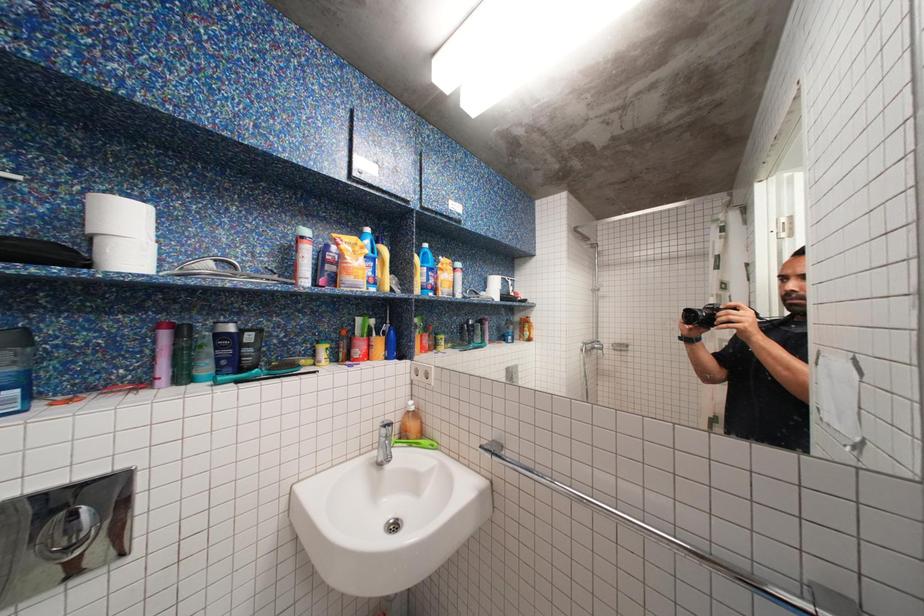
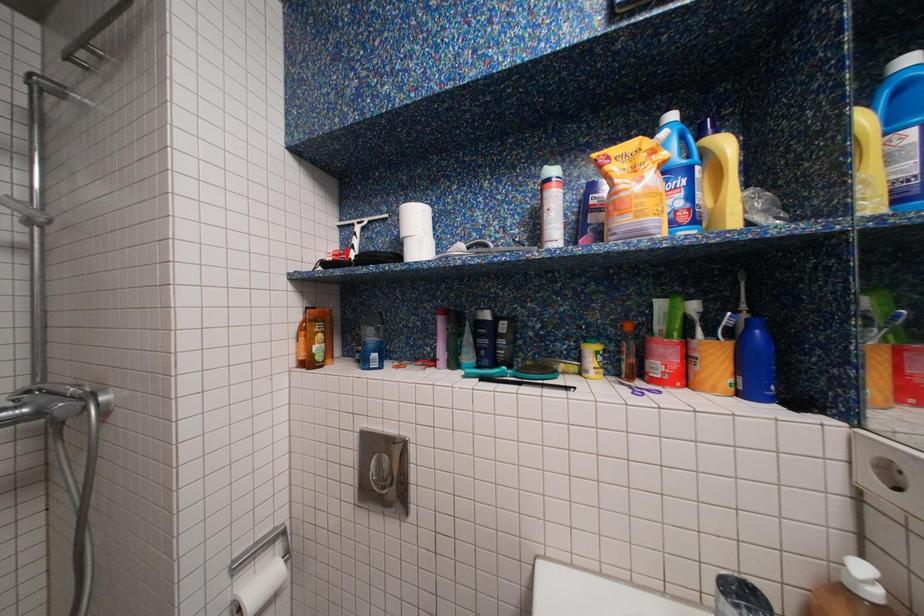
Question: Based on the continuous images, in which direction is the camera rotating? Reply with the corresponding letter.

Choices:
 (A) Left
 (B) Right
 (C) Up
 (D) Down

Answer: (A)